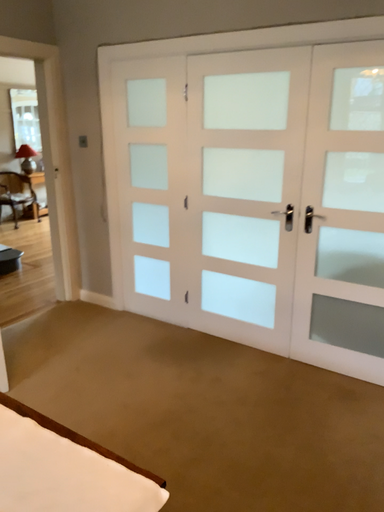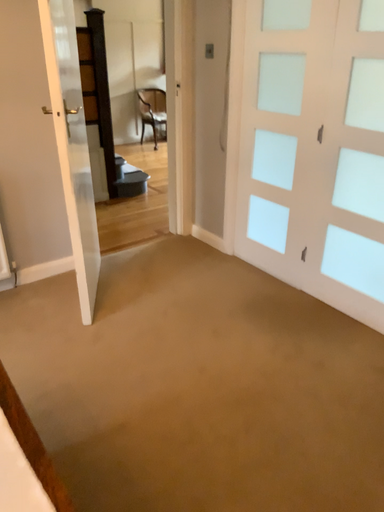
Question: Which way did the camera rotate in the video?

Choices:
 (A) rotated downward
 (B) rotated upward

Answer: (A)